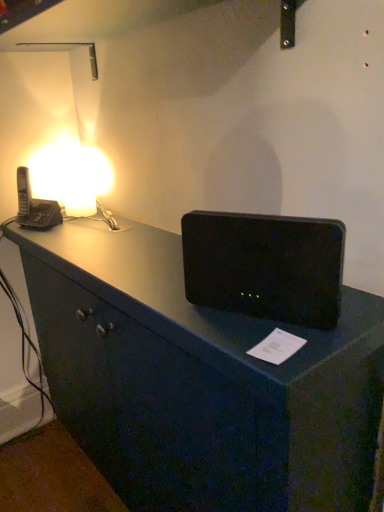
Question: Considering their positions, is black plastic phone at left located in front of or behind matte white lamp at upper left?

Choices:
 (A) front
 (B) behind

Answer: (A)

Question: Choose the correct answer: Is black plastic phone at left inside matte white lamp at upper left or outside it?

Choices:
 (A) inside
 (B) outside

Answer: (B)

Question: Which object is the closest to the matte white lamp at upper left?

Choices:
 (A) black plastic phone at left
 (B) black plastic speaker at center

Answer: (A)

Question: Which object is the farthest from the matte white lamp at upper left?

Choices:
 (A) black plastic speaker at center
 (B) black plastic phone at left

Answer: (A)